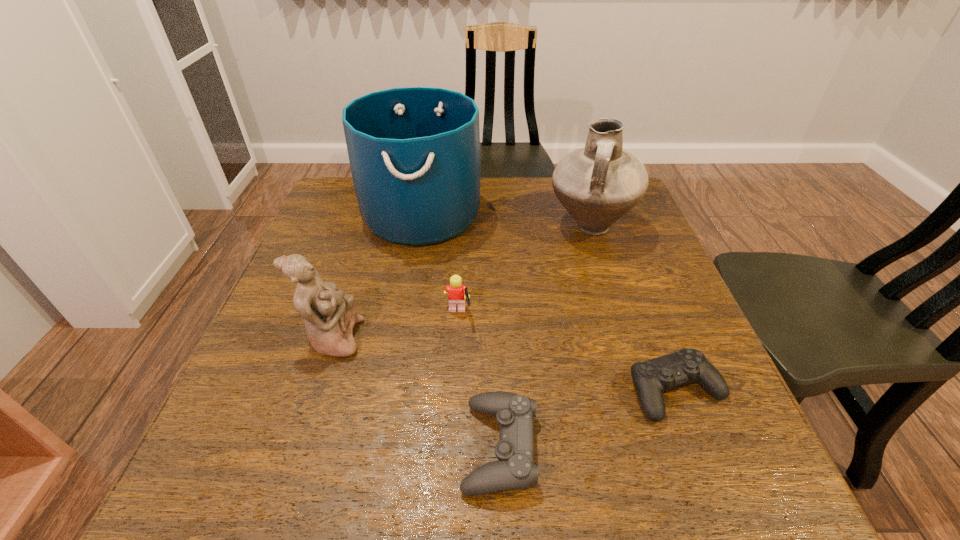
Identify the location of object present at the far right corner. The width and height of the screenshot is (960, 540). (598, 184).

Locate an element on the screen. The height and width of the screenshot is (540, 960). free space at the far edge is located at coordinates (487, 187).

This screenshot has height=540, width=960. What are the coordinates of `vacant space at the left edge of the desktop` in the screenshot? It's located at (298, 387).

Locate an element on the screen. The image size is (960, 540). free space at the right edge is located at coordinates (648, 289).

You are a GUI agent. You are given a task and a screenshot of the screen. Output one action in this format:
    pyautogui.click(x=<x>, y=<y>)
    Task: Click on the free spot between the right control and the pitcher
    
    Given the screenshot: What is the action you would take?
    pyautogui.click(x=633, y=309)

Where is `vacant space in between the bucket and the Lego`? The image size is (960, 540). vacant space in between the bucket and the Lego is located at coordinates (440, 264).

Where is `empty space between the pitcher and the left control`? The image size is (960, 540). empty space between the pitcher and the left control is located at coordinates (545, 337).

The width and height of the screenshot is (960, 540). What are the coordinates of `empty space that is in between the left control and the figurine` in the screenshot? It's located at pyautogui.click(x=417, y=393).

Find the location of a particular element. The width and height of the screenshot is (960, 540). free point between the fourth shortest object and the right control is located at coordinates (504, 364).

Find the location of `vacant point located between the fourth shortest object and the right control`. vacant point located between the fourth shortest object and the right control is located at coordinates (504, 364).